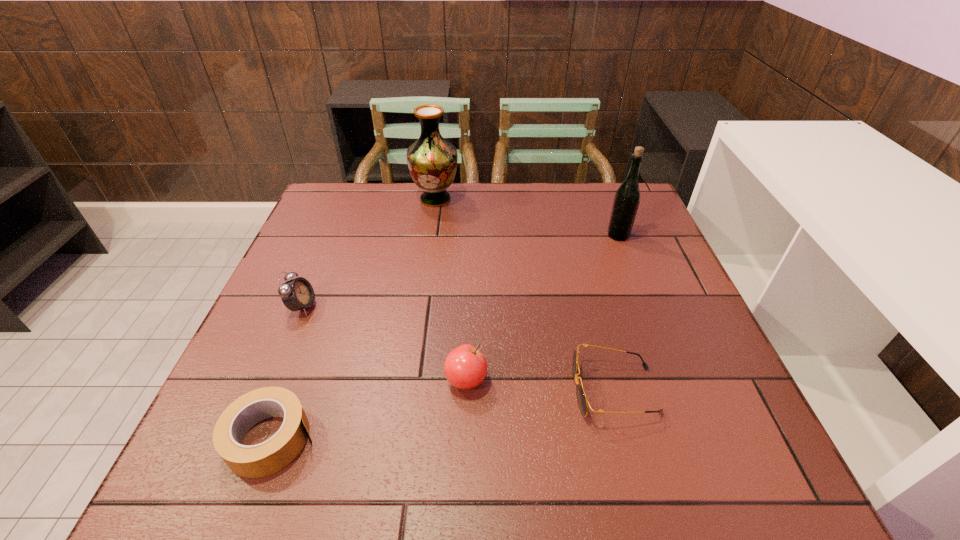
The image size is (960, 540). What are the coordinates of `beer bottle that is at the right edge` in the screenshot? It's located at (627, 198).

Find the location of `sunglasses located in the right edge section of the desktop`. sunglasses located in the right edge section of the desktop is located at coordinates (582, 400).

This screenshot has width=960, height=540. I want to click on object located in the near left corner section of the desktop, so click(251, 461).

In the image, there is a desktop. Where is `free space at the far edge`? The image size is (960, 540). free space at the far edge is located at coordinates (545, 185).

Find the location of a particular element. Image resolution: width=960 pixels, height=540 pixels. vacant space at the left edge of the desktop is located at coordinates (312, 253).

Where is `free space at the right edge of the desktop`? The image size is (960, 540). free space at the right edge of the desktop is located at coordinates (710, 339).

Image resolution: width=960 pixels, height=540 pixels. Identify the location of vacant region between the fifth nearest object and the duct tape. (444, 337).

In order to click on vacant area that lies between the duct tape and the vase in this screenshot , I will do `click(353, 319)`.

Identify the location of vacant space that's between the second farthest object and the second object from right to left. (616, 313).

Locate an element on the screen. The width and height of the screenshot is (960, 540). vacant area between the beer bottle and the alarm clock is located at coordinates (460, 271).